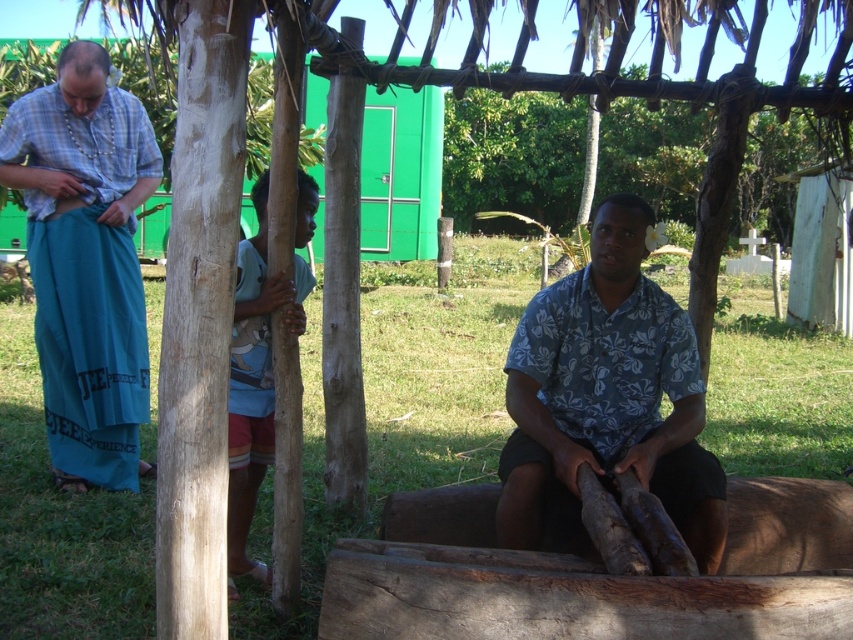
Question: Among these points, which one is farthest from the camera?

Choices:
 (A) (509, 164)
 (B) (270, 582)

Answer: (A)

Question: Which of these objects is positioned farthest from the light blue fabric at center?

Choices:
 (A) floral print shirt at center
 (B) brown rough wood at upper center
 (C) teal fabric sarong at left

Answer: (B)

Question: Which object is farther from the camera taking this photo?

Choices:
 (A) teal fabric sarong at left
 (B) light blue fabric at center
 (C) floral print shirt at center
 (D) brown rough wood at upper center

Answer: (D)

Question: Does floral print shirt at center appear under brown rough wood at upper center?

Choices:
 (A) no
 (B) yes

Answer: (B)

Question: Is floral print shirt at center thinner than teal fabric sarong at left?

Choices:
 (A) no
 (B) yes

Answer: (B)

Question: Can you confirm if teal fabric sarong at left is smaller than light blue fabric at center?

Choices:
 (A) yes
 (B) no

Answer: (B)